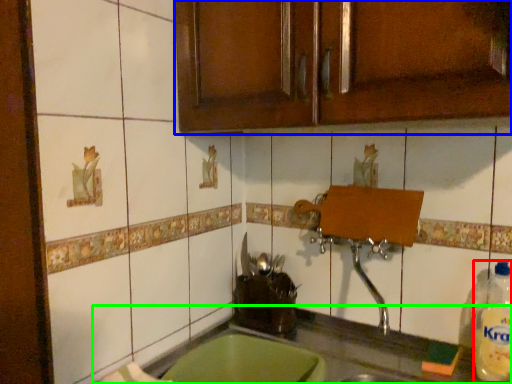
Question: Which is farther away from bottle (highlighted by a red box)? cabinetry (highlighted by a blue box) or countertop (highlighted by a green box)?

Choices:
 (A) cabinetry
 (B) countertop

Answer: (A)